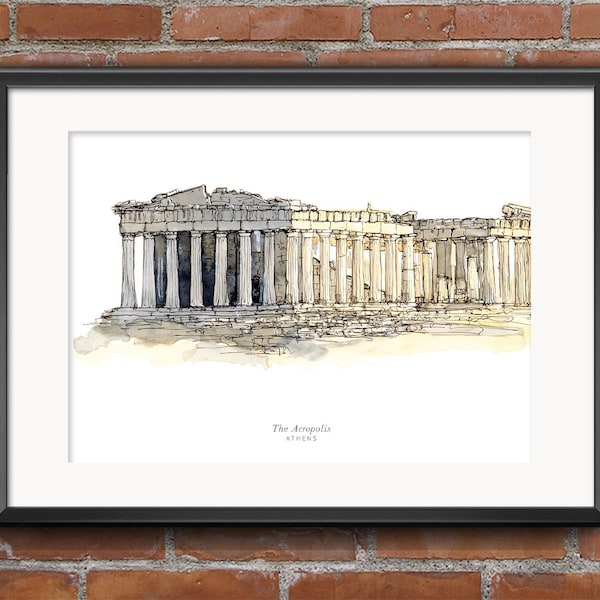
Locate an element on the screen. brick wall is located at coordinates (306, 37), (354, 571).